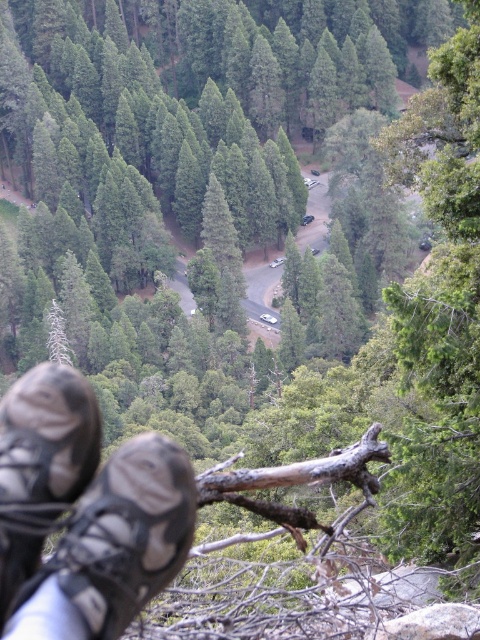
You are standing on a rocky outcrop overlooking a forest. You notice two shoes at your feet. Which shoe is positioned lower relative to the other? The options are the black mesh shoe at lower left and the black suede shoe at lower left.

The black mesh shoe at lower left is positioned below the black suede shoe at lower left, so it is lower.

You are a photographer setting up a tripod next to the black mesh shoe at lower left and the black suede shoe at lower left. Which shoe should you avoid placing the tripod near to ensure it doesn t get knocked over easily?

You should avoid placing the tripod near the black mesh shoe at lower left because it is larger in size than the black suede shoe at lower left, providing more space for accidental contact.

You are a hiker standing on a rocky trail overlooking a forest. You notice two shoes at the lower left corner of your view. Which shoe is closer to you, the black mesh shoe at lower left or the black suede shoe at lower left?

The black mesh shoe at lower left is closer to you because it is positioned in front of the black suede shoe at lower left.